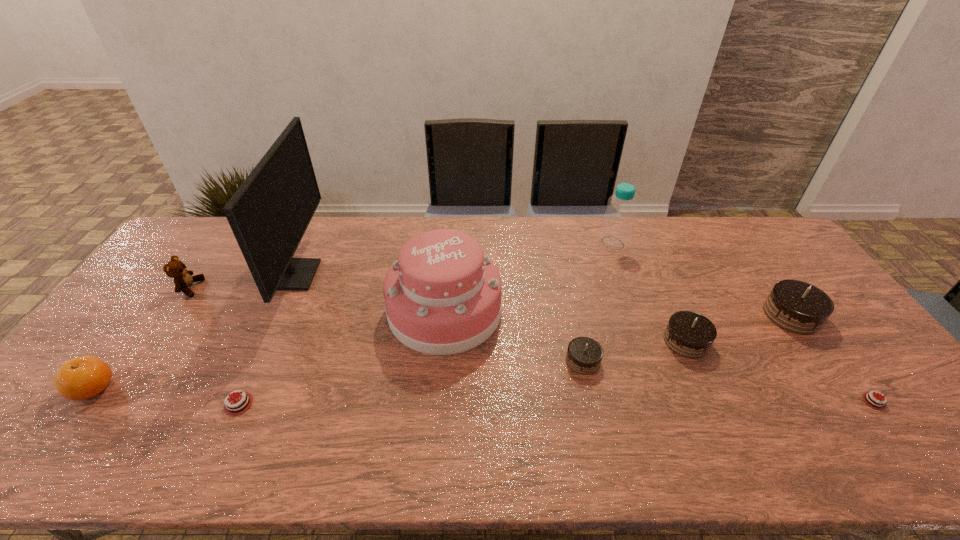
You are a GUI agent. You are given a task and a screenshot of the screen. Output one action in this format:
    pyautogui.click(x=<x>, y=<y>)
    Task: Click on the vacant space situated 0.050m on the front-facing side of the teddy bear
    
    Given the screenshot: What is the action you would take?
    [x=217, y=288]

Find the location of a particular element. The height and width of the screenshot is (540, 960). vacant region located 0.330m on the back of the second biggest chocolate chocolate cake is located at coordinates (647, 252).

Locate an element on the screen. vacant position located 0.330m on the back of the orange clementine is located at coordinates (172, 284).

You are a GUI agent. You are given a task and a screenshot of the screen. Output one action in this format:
    pyautogui.click(x=<x>, y=<y>)
    Task: Click on the free space located 0.060m on the right of the leftmost chocolate chocolate cake
    
    Given the screenshot: What is the action you would take?
    pyautogui.click(x=623, y=361)

This screenshot has width=960, height=540. In order to click on vacant space situated on the right of the leftmost chocolate cake in this screenshot , I will do `click(318, 404)`.

The height and width of the screenshot is (540, 960). Identify the location of vacant space located on the left of the right red chocolate cake. (724, 401).

Identify the location of computer monitor located in the far edge section of the desktop. This screenshot has height=540, width=960. (269, 213).

The image size is (960, 540). What are the coordinates of `bottle at the far edge` in the screenshot? It's located at (617, 224).

Locate an element on the screen. The image size is (960, 540). teddy bear that is positioned at the left edge is located at coordinates (176, 269).

This screenshot has width=960, height=540. I want to click on clementine that is at the left edge, so click(81, 378).